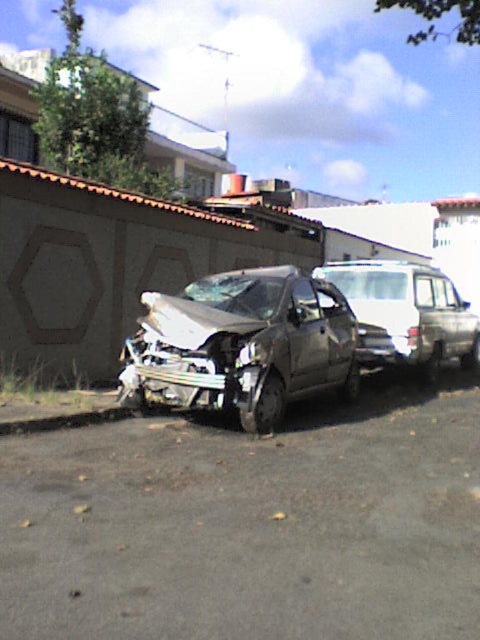
You are a tow truck operator and need to tow the damaged car. The tow truck can only approach from the front of the damaged car. Is the point marked by coordinates point at point (240, 346) obstructed by the white van?

The point marked by coordinates point at point (240, 346) is obstructed by the white van because the van is parked behind the damaged car, blocking access to that point.

You are a tow truck driver who needs to tow the silver metallic car at center and the silver metallic van at center. Since the tow truck can only tow one vehicle at a time, which vehicle should you tow first to ensure the other can exit the scene safely?

The silver metallic car at center is positioned on the left side of the silver metallic van at center. Therefore, you should tow the silver metallic car at center first to allow the silver metallic van at center to exit without obstruction.